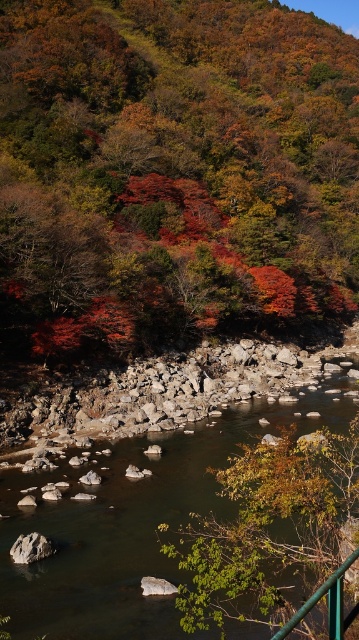
You are standing on a bridge overlooking the smooth rock stream at center. If you want to toss a pebble into the stream, but you can only throw 15 meters, will you be able to reach it?

The smooth rock stream at center is 15.12 meters away from viewer, which is slightly farther than your throwing distance of 15 meters. You won

You are an artist sketching the autumn scene. You notice the autumn leaves at upper center and the green leafy tree at lower center. Which object would you need to draw with a wider brush stroke to capture their size accurately?

The autumn leaves at upper center might be wider than the green leafy tree at lower center, so you should use a wider brush stroke for the autumn leaves at upper center to accurately depict their size.

You are standing at the point marked as point (x=174, y=164) in the image. What can you see directly in front of you?

Autumn leaves at upper center are directly in front of you at point (x=174, y=164).